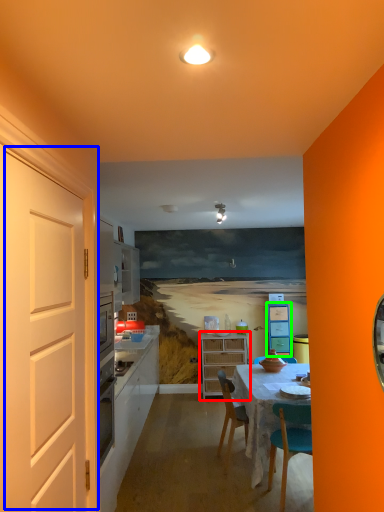
Question: Which is nearer to the cabinetry (highlighted by a red box)? door (highlighted by a blue box) or cabinetry (highlighted by a green box).

Choices:
 (A) door
 (B) cabinetry

Answer: (B)